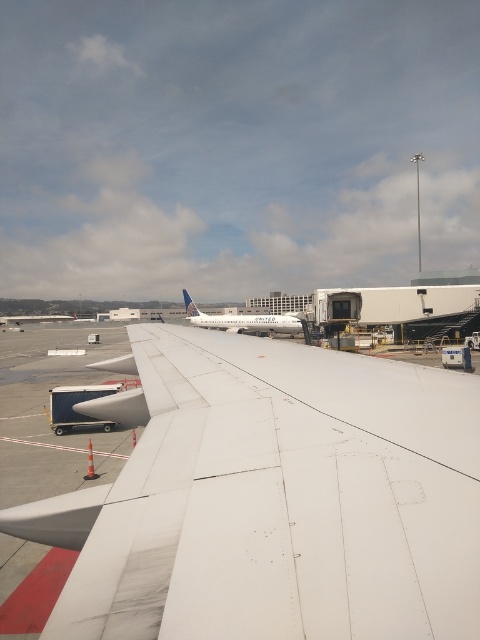
Question: Which object appears closest to the camera in this image?

Choices:
 (A) white matte airplane at center
 (B) white matte wing at center

Answer: (B)

Question: Estimate the real-world distances between objects in this image. Which object is closer to the white matte airplane tail at center?

Choices:
 (A) white matte airplane at center
 (B) white matte wing at center

Answer: (A)

Question: Is white matte wing at center below white matte airplane tail at center?

Choices:
 (A) yes
 (B) no

Answer: (A)

Question: Observing the image, what is the correct spatial positioning of white matte wing at center in reference to white matte airplane at center?

Choices:
 (A) right
 (B) left

Answer: (A)

Question: Can you confirm if white matte wing at center is wider than white matte airplane at center?

Choices:
 (A) yes
 (B) no

Answer: (B)

Question: Considering the real-world distances, which object is farthest from the white matte wing at center?

Choices:
 (A) white matte airplane tail at center
 (B) white matte airplane at center

Answer: (A)